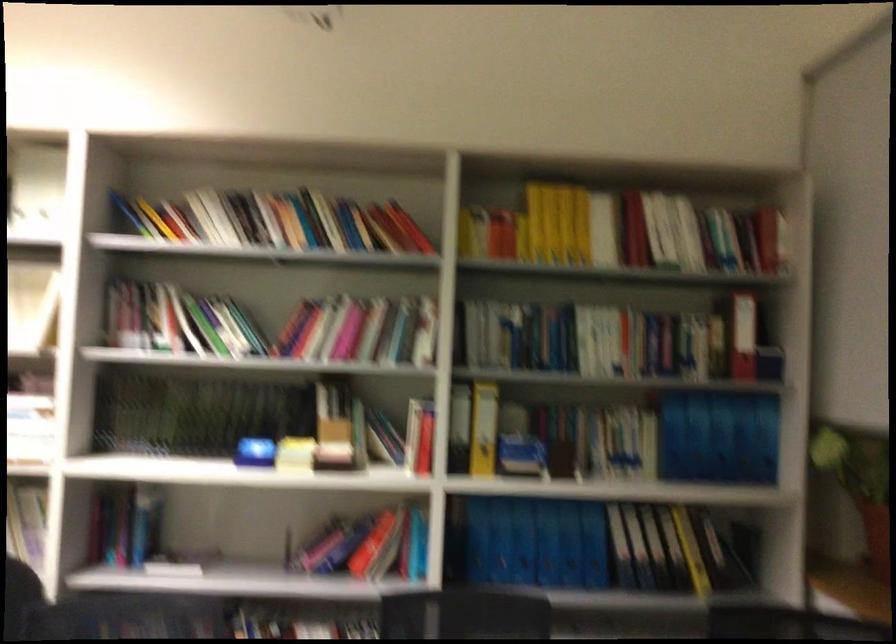
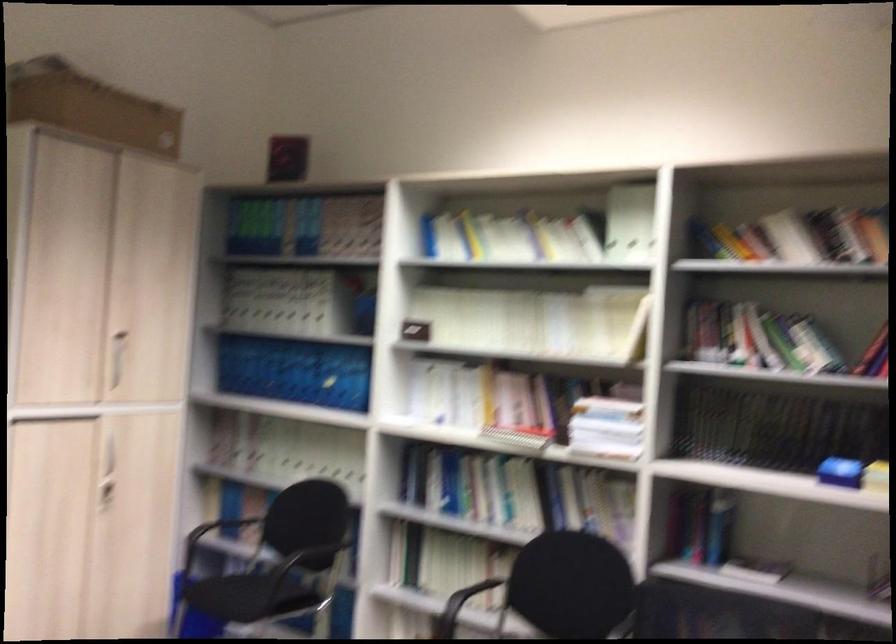
Question: The camera is either moving clockwise (left) or counter-clockwise (right) around the object. The first image is from the beginning of the video and the second image is from the end. Is the camera moving left or right when shooting the video?

Choices:
 (A) Left
 (B) Right

Answer: (B)